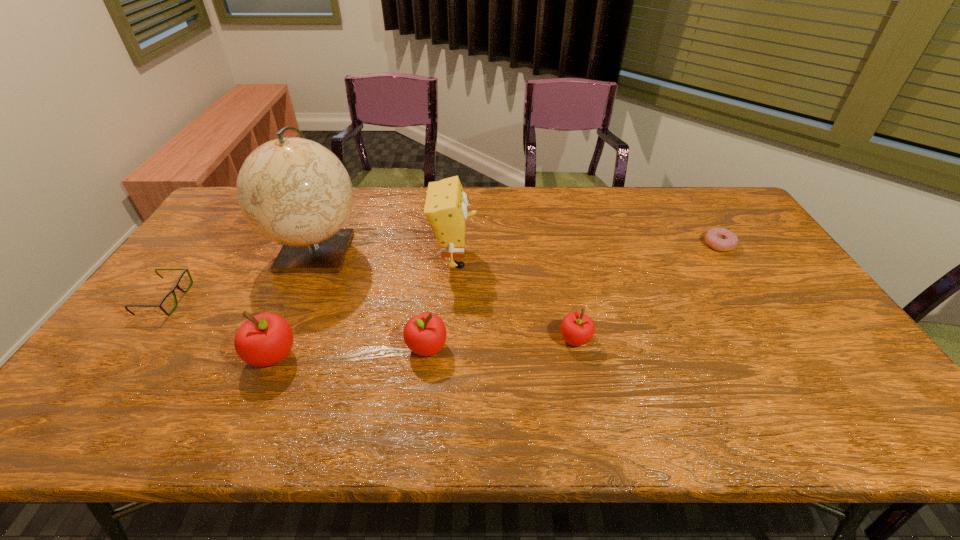
Where is `the leftmost apple`? the leftmost apple is located at coordinates (265, 339).

The image size is (960, 540). In order to click on the fifth shortest object in this screenshot , I will do `click(265, 339)`.

Find the location of a particular element. the second apple from right to left is located at coordinates (424, 334).

Find the location of `the fourth shortest object`. the fourth shortest object is located at coordinates (424, 334).

Image resolution: width=960 pixels, height=540 pixels. In order to click on the second object from right to left in this screenshot , I will do `click(577, 329)`.

The width and height of the screenshot is (960, 540). Identify the location of the rightmost apple. (577, 329).

The image size is (960, 540). Find the location of `the tallest object`. the tallest object is located at coordinates (294, 191).

Where is `the sixth tallest object`? This screenshot has width=960, height=540. the sixth tallest object is located at coordinates (176, 285).

Find the location of a particular element. spectacles is located at coordinates (176, 285).

Locate an element on the screen. Image resolution: width=960 pixels, height=540 pixels. the rightmost object is located at coordinates (x=720, y=239).